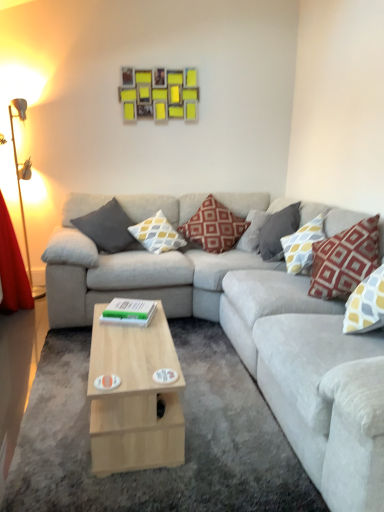
Question: From the image's perspective, is light gray fabric couch at center above or below yellow and gray patterned pillow at right, acting as the 5th pillow starting from the left?

Choices:
 (A) above
 (B) below

Answer: (B)

Question: Choose the correct answer: Is light gray fabric couch at center inside yellow and gray patterned pillow at right, the 2th pillow in the right-to-left sequence, or outside it?

Choices:
 (A) outside
 (B) inside

Answer: (A)

Question: Based on their relative distances, which object is farther from the metallic gold table lamp at left?

Choices:
 (A) yellow and gray patterned pillow at right, the 2th pillow in the right-to-left sequence
 (B) red textured pillow at right, which ranks as the first pillow in right-to-left order
 (C) yellow and gray patterned pillow at center, positioned as the 5th pillow in right-to-left order
 (D) dark gray fabric pillow at left, acting as the 6th pillow starting from the right
 (E) light wood/wooden coffee table at center

Answer: (B)

Question: Which of these objects is positioned farthest from the light gray fabric couch at center?

Choices:
 (A) green matte book at center
 (B) red fabric pillow at center, which ranks as the fourth pillow in right-to-left order
 (C) yellow and gray patterned pillow at center, which ranks as the 2th pillow in left-to-right order
 (D) yellow and gray patterned pillow at right, the 2th pillow in the right-to-left sequence
 (E) red textured pillow at right, the 6th pillow positioned from the left

Answer: (C)